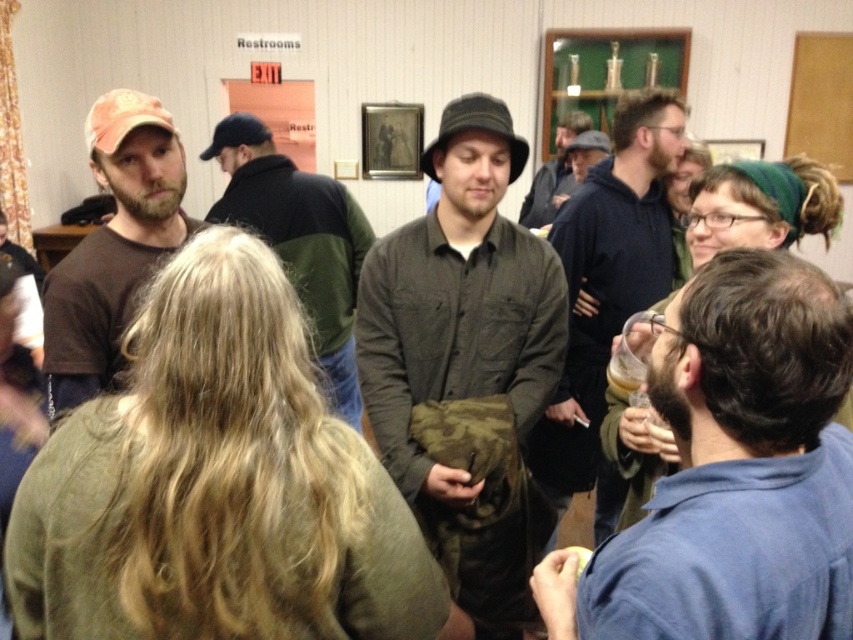
You are standing at the camera position and want to reach point (776, 518). Is the distance more than 30 inches?

The distance between the camera and point (776, 518) is 30.76 inches, so yes, it is more than 30 inches.

Based on the photo, you are standing in the room and want to move from point A to point B. Point A is at coordinate point [833,298] and point B is at coordinate point [184,161]. Which point is closer to you when you first enter the room?

Point A at coordinate point [833,298] is closer to you because it is closer to the camera than point B at coordinate point [184,161].

You are trying to spot two people in the room. One is wearing a blue shirt at right and the other is wearing a matte brown shirt at left. Which person is shorter?

The blue shirt at right is shorter than the matte brown shirt at left because the blue shirt at right is not as tall as matte brown shirt at left.